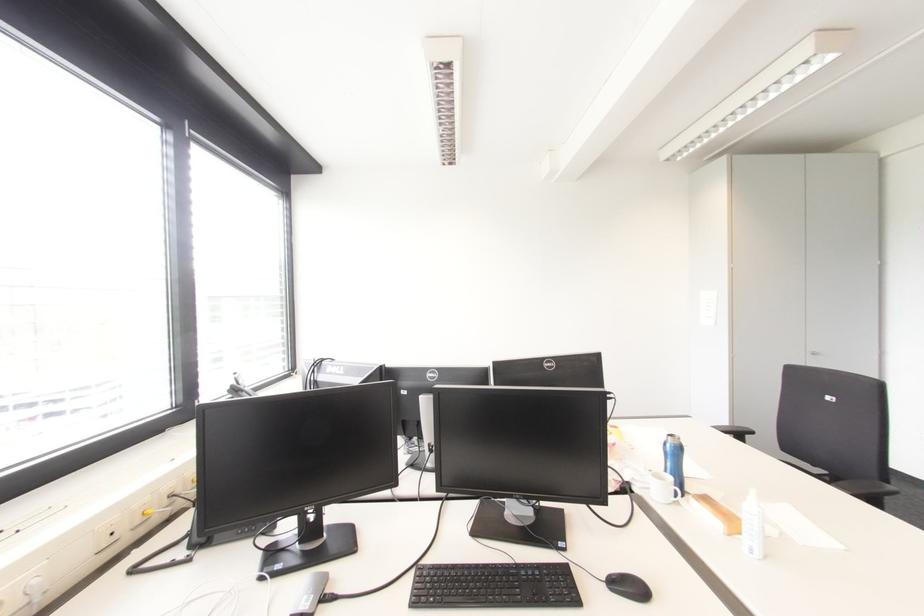
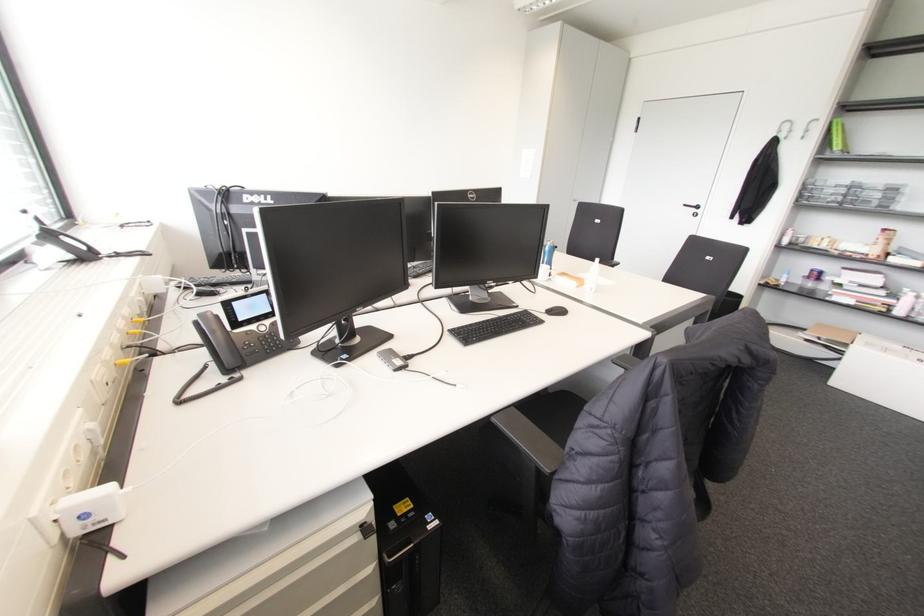
Find the pixel in the second image that matches (463,565) in the first image.

(476, 323)